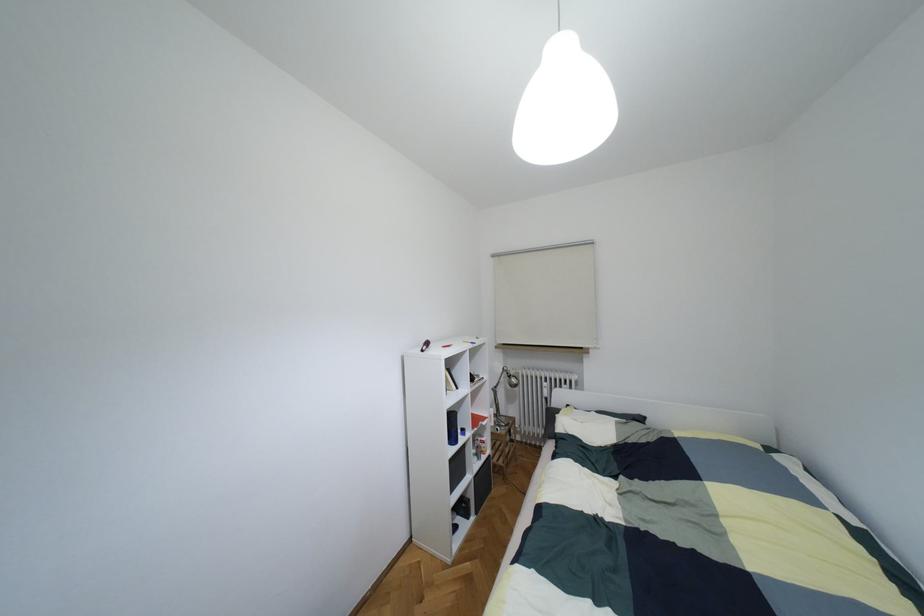
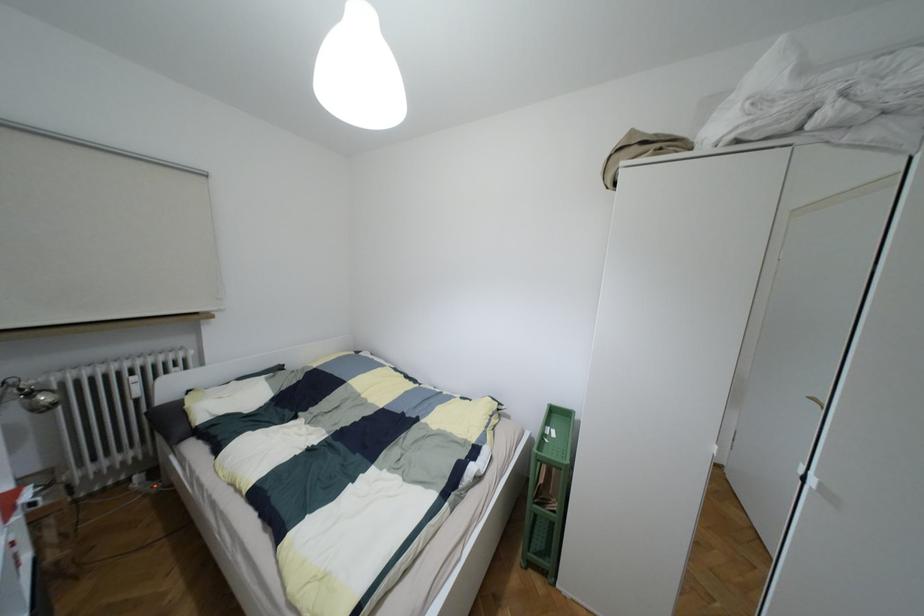
Find the pixel in the second image that matches pixel 513 379 in the first image.

(43, 397)